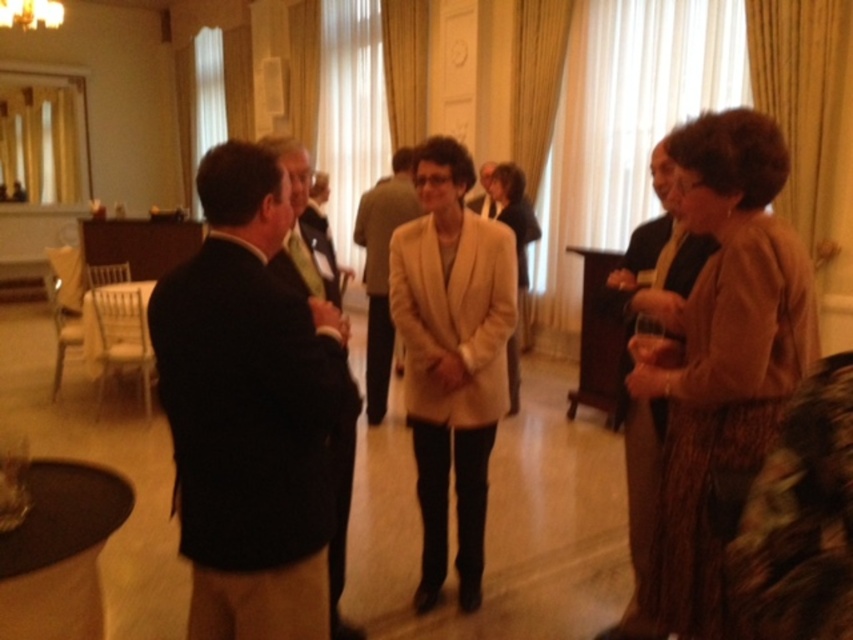
You are organizing a coat rack for guests at this event. You have two coats to hang up. The first is the light brown textured blazer at right, and the second is the dark suit jacket at center. Which coat requires a larger hanger based on their sizes?

The light brown textured blazer at right requires a larger hanger because it is larger in size than the dark suit jacket at center.

You are a photographer positioned at the back of the room. You want to take a photo that includes both the dark suit jacket at left and the light beige suit at center. Which suit will appear larger in the photo?

The dark suit jacket at left will appear larger in the photo because it is closer to the viewer than the light beige suit at center.

You are standing in the room and want to hand a document to both the person wearing the light brown textured blazer at right and the person in the dark suit jacket at center. Which person should you approach first if you want to reach the one closer to you?

You should approach the dark suit jacket at center first because the light brown textured blazer at right is located above it, meaning the dark suit jacket at center is closer to you.